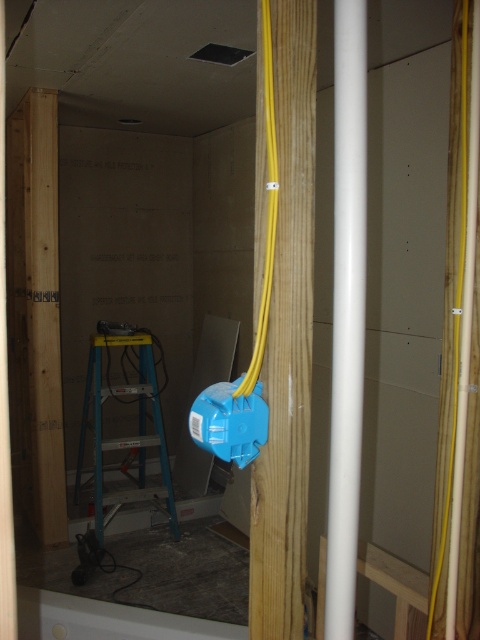
Measure the distance between yellow wood pillar at center and yellow rubber cable at center.

yellow wood pillar at center and yellow rubber cable at center are 9.28 centimeters apart from each other.

Who is higher up, yellow wood pillar at center or yellow rubber cable at center?

yellow rubber cable at center is above.

Who is more forward, (286, 259) or (262, 4)?

Point (262, 4)

The image size is (480, 640). In order to click on yellow wood pillar at center in this screenshot , I will do `click(287, 340)`.

Does yellow wood pillar at center have a greater height compared to white smooth pipe at center?

Correct, yellow wood pillar at center is much taller as white smooth pipe at center.

Is yellow wood pillar at center to the left of white smooth pipe at center from the viewer's perspective?

Yes, yellow wood pillar at center is to the left of white smooth pipe at center.

The width and height of the screenshot is (480, 640). What do you see at coordinates (287, 340) in the screenshot?
I see `yellow wood pillar at center` at bounding box center [287, 340].

Find the location of `yellow wood pillar at center`. yellow wood pillar at center is located at coordinates (287, 340).

Does white smooth pipe at center have a greater width compared to yellow rubber cable at center?

Incorrect, white smooth pipe at center's width does not surpass yellow rubber cable at center's.

Based on the photo, measure the distance between white smooth pipe at center and yellow rubber cable at center.

The distance of white smooth pipe at center from yellow rubber cable at center is 6.31 inches.

Who is more forward, (355, 456) or (243, 381)?

Point (355, 456) is more forward.

This screenshot has height=640, width=480. I want to click on white smooth pipe at center, so click(x=347, y=312).